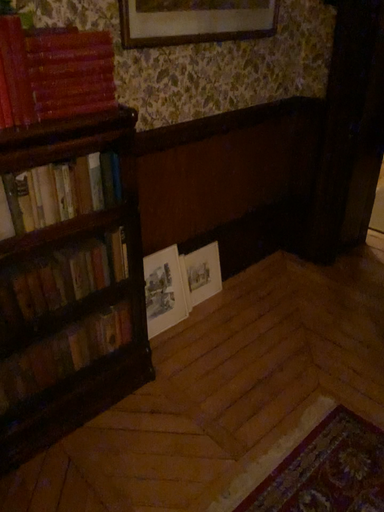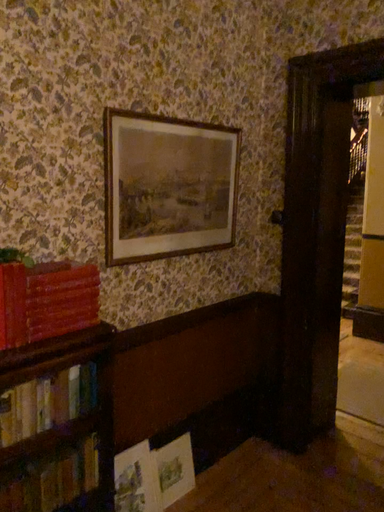
Question: How did the camera likely rotate when shooting the video?

Choices:
 (A) rotated downward
 (B) rotated upward

Answer: (B)